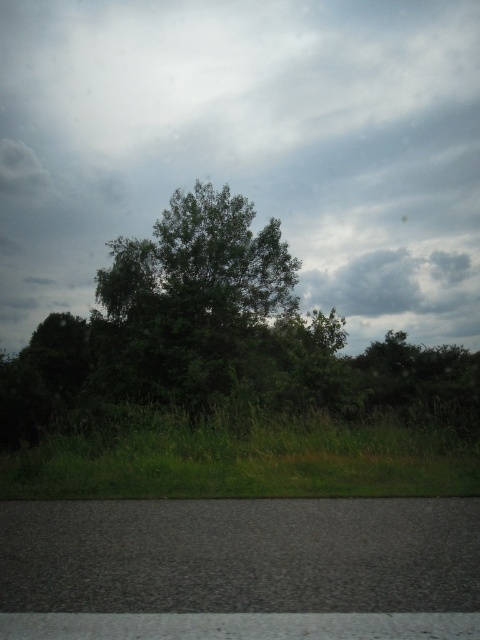
You are a photographer trying to capture a landscape photo from the moving vehicle. You notice two points marked in the scene. Which point is closer to the camera? Please choose between the point at coordinates (189, 401) and the point at (144, 454).

Point (144, 454) is closer to the camera because it is not as far as point (189, 401) which is further away.

Consider the image. You are a photographer trying to capture a landscape shot that includes both the cloudy sky at upper center and the green grass at lower center. Based on the scene, which of these two elements occupies a larger portion of the image vertically?

The cloudy sky at upper center is taller than the green grass at lower center, so the cloudy sky at upper center occupies a larger portion vertically.